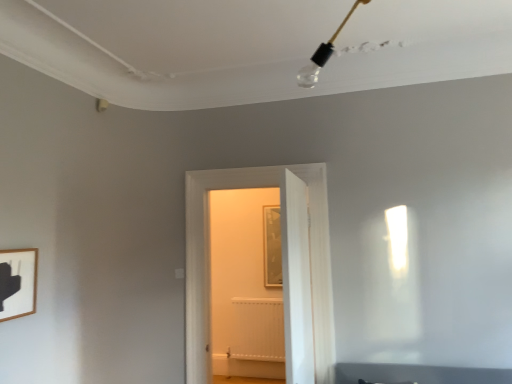
Question: Can you confirm if white matte radiator at center is shorter than wooden picture frame at lower left?

Choices:
 (A) no
 (B) yes

Answer: (A)

Question: From the image's perspective, is white matte radiator at center under wooden picture frame at lower left?

Choices:
 (A) no
 (B) yes

Answer: (B)

Question: Is white matte radiator at center not inside wooden picture frame at lower left?

Choices:
 (A) yes
 (B) no

Answer: (A)

Question: Does white matte radiator at center appear on the left side of wooden picture frame at lower left?

Choices:
 (A) yes
 (B) no

Answer: (B)

Question: From a real-world perspective, is white matte radiator at center on wooden picture frame at lower left?

Choices:
 (A) no
 (B) yes

Answer: (A)

Question: Does white matte radiator at center have a smaller size compared to wooden picture frame at lower left?

Choices:
 (A) yes
 (B) no

Answer: (B)

Question: Can you confirm if white matte radiator at center is shorter than white wooden door at center, the first door from the front?

Choices:
 (A) no
 (B) yes

Answer: (B)

Question: From the image's perspective, does white matte radiator at center appear lower than white wooden door at center, acting as the 2th door starting from the back?

Choices:
 (A) yes
 (B) no

Answer: (A)

Question: Considering the relative positions of white matte radiator at center and white wooden door at center, acting as the 2th door starting from the back, in the image provided, is white matte radiator at center behind white wooden door at center, acting as the 2th door starting from the back,?

Choices:
 (A) yes
 (B) no

Answer: (A)

Question: Can you confirm if white matte radiator at center is bigger than white wooden door at center, acting as the 2th door starting from the back?

Choices:
 (A) no
 (B) yes

Answer: (A)

Question: Is white wooden door at center, acting as the 2th door starting from the back, completely or partially inside white matte radiator at center?

Choices:
 (A) no
 (B) yes

Answer: (A)

Question: Does white matte radiator at center appear on the right side of white wooden door at center, acting as the 2th door starting from the back?

Choices:
 (A) no
 (B) yes

Answer: (A)

Question: Is wooden picture frame at lower left located outside white wooden door at center, the 2th door in the front-to-back sequence?

Choices:
 (A) yes
 (B) no

Answer: (A)